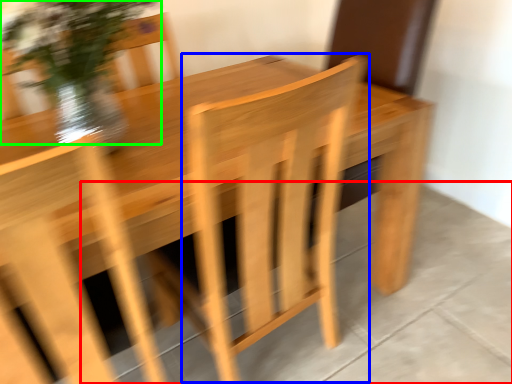
Question: Considering the real-world distances, which object is farthest from concrete (highlighted by a red box)? armchair (highlighted by a blue box) or floral arrangement (highlighted by a green box)?

Choices:
 (A) armchair
 (B) floral arrangement

Answer: (B)